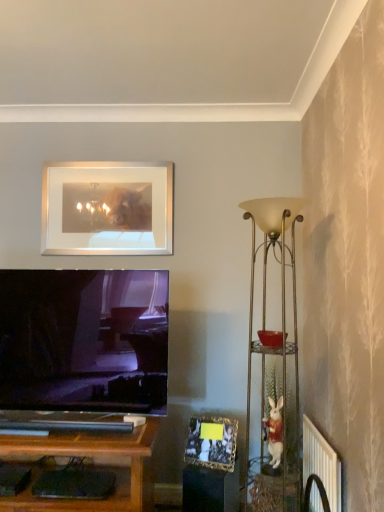
Where is `free spot above silver/metallic picture frame at upper center, placed as the second picture frame when sorted from bottom to top (from a real-world perspective)`? The image size is (384, 512). free spot above silver/metallic picture frame at upper center, placed as the second picture frame when sorted from bottom to top (from a real-world perspective) is located at coordinates (105, 160).